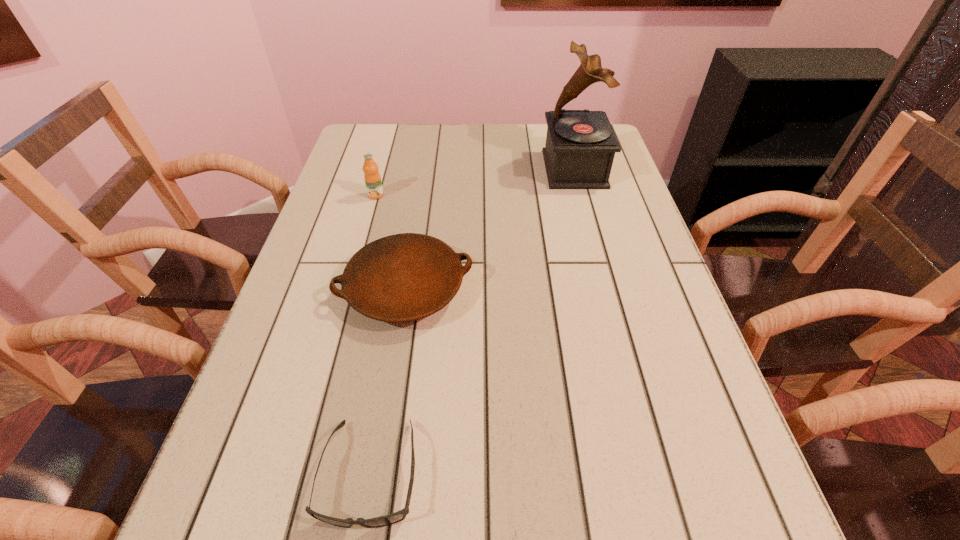
Where is `object that is at the far right corner`? The height and width of the screenshot is (540, 960). object that is at the far right corner is located at coordinates (580, 147).

The width and height of the screenshot is (960, 540). Identify the location of vacant space at the far edge. (467, 144).

In the image, there is a desktop. At what (x,y) coordinates should I click in order to perform the action: click on vacant region at the left edge. Please return your answer as a coordinate pair (x, y). Image resolution: width=960 pixels, height=540 pixels. Looking at the image, I should click on (310, 368).

Where is `free space at the right edge`? The image size is (960, 540). free space at the right edge is located at coordinates (583, 238).

You are a GUI agent. You are given a task and a screenshot of the screen. Output one action in this format:
    pyautogui.click(x=<x>, y=<y>)
    Task: Click on the free space at the far left corner of the desktop
    The height and width of the screenshot is (540, 960).
    Given the screenshot: What is the action you would take?
    pyautogui.click(x=367, y=130)

You are a GUI agent. You are given a task and a screenshot of the screen. Output one action in this format:
    pyautogui.click(x=<x>, y=<y>)
    Task: Click on the empty location between the second shortest object and the rightmost object
    The height and width of the screenshot is (540, 960).
    Given the screenshot: What is the action you would take?
    pyautogui.click(x=490, y=229)

You are a GUI agent. You are given a task and a screenshot of the screen. Output one action in this format:
    pyautogui.click(x=<x>, y=<y>)
    Task: Click on the vacant region between the third farthest object and the phonograph_record
    Image resolution: width=960 pixels, height=540 pixels.
    Given the screenshot: What is the action you would take?
    pyautogui.click(x=490, y=229)

In order to click on empty location between the second tallest object and the farthest object in this screenshot , I will do `click(475, 182)`.

Locate an element on the screen. This screenshot has width=960, height=540. free space between the plate and the shortest object is located at coordinates (388, 381).

What are the coordinates of `vacant area between the third farthest object and the nearest object` in the screenshot? It's located at (388, 381).